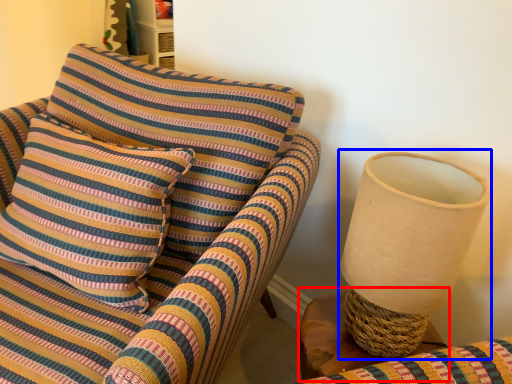
Question: Among these objects, which one is nearest to the camera, table (highlighted by a red box) or table lamp (highlighted by a blue box)?

Choices:
 (A) table
 (B) table lamp

Answer: (B)